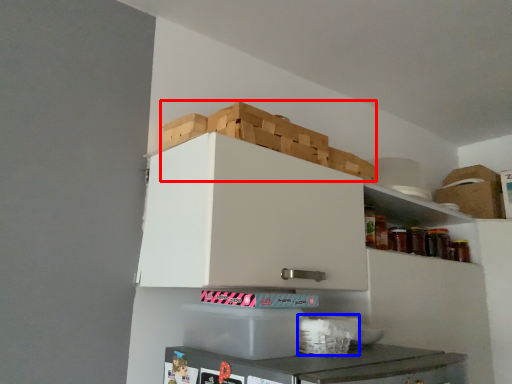
Question: Which object is further to the camera taking this photo, crate (highlighted by a red box) or basket (highlighted by a blue box)?

Choices:
 (A) crate
 (B) basket

Answer: (A)